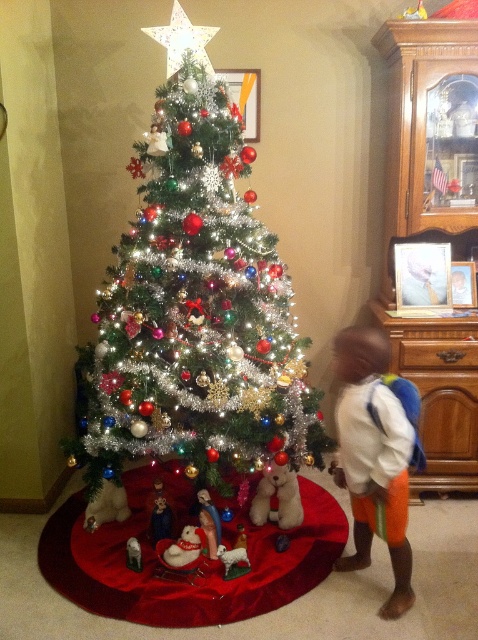
Does white cotton shirt at center have a lesser height compared to white plush reindeer at lower center?

No.

Does white cotton shirt at center have a larger size compared to white plush reindeer at lower center?

Indeed, white cotton shirt at center has a larger size compared to white plush reindeer at lower center.

Does point (347, 406) come in front of point (128, 548)?

That is True.

Image resolution: width=478 pixels, height=640 pixels. Identify the location of white cotton shirt at center. (373, 458).

From the picture: Who is positioned more to the left, shiny silver christmas tree at center or fluffy white teddy bear at lower center?

shiny silver christmas tree at center is more to the left.

Which is behind, point (185, 163) or point (294, 520)?

The point (294, 520) is behind.

Locate an element on the screen. This screenshot has width=478, height=640. shiny silver christmas tree at center is located at coordinates (194, 305).

Is point (382, 532) positioned behind point (263, 506)?

That is False.

Which is below, white cotton shirt at center or fluffy white teddy bear at lower center?

fluffy white teddy bear at lower center is below.

Between point (402, 548) and point (262, 477), which one is positioned in front?

Point (402, 548) is more forward.

Find the location of a particular element. Image resolution: width=478 pixels, height=640 pixels. white cotton shirt at center is located at coordinates (373, 458).